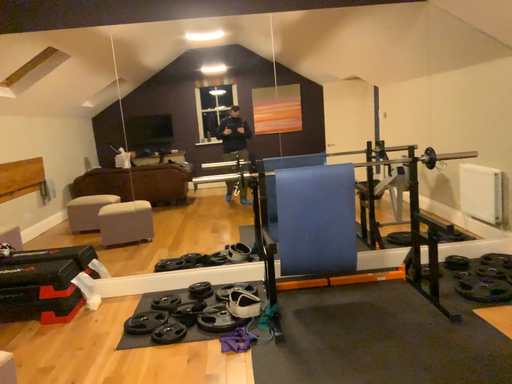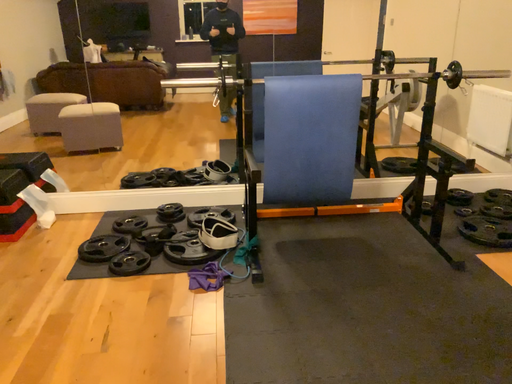
Question: Which way did the camera rotate in the video?

Choices:
 (A) rotated downward
 (B) rotated upward

Answer: (A)